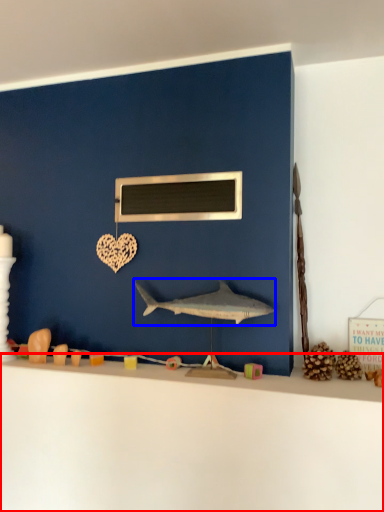
Question: Which point is closer to the camera, counter top (highlighted by a red box) or shark (highlighted by a blue box)?

Choices:
 (A) counter top
 (B) shark

Answer: (A)